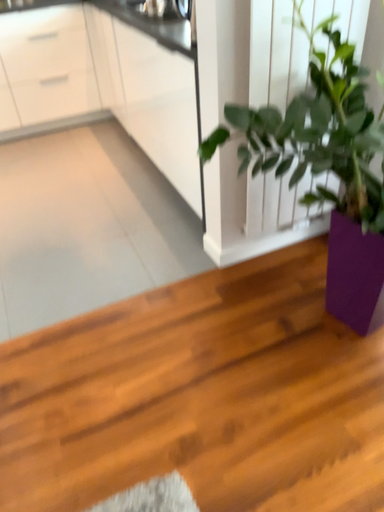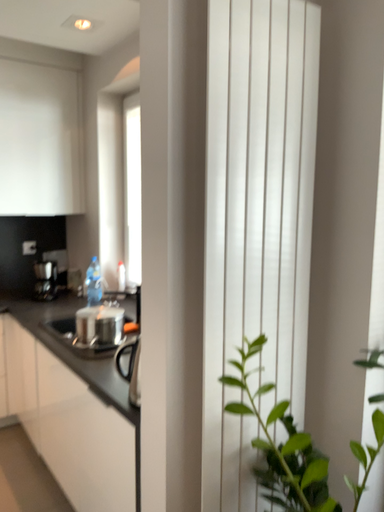
Question: How did the camera likely rotate when shooting the video?

Choices:
 (A) rotated downward
 (B) rotated upward

Answer: (B)